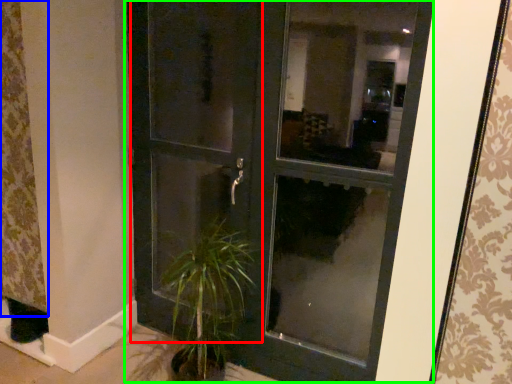
Question: Based on their relative distances, which object is nearer to screen door (highlighted by a red box)? Choose from curtain (highlighted by a blue box) and door (highlighted by a green box).

Choices:
 (A) curtain
 (B) door

Answer: (B)